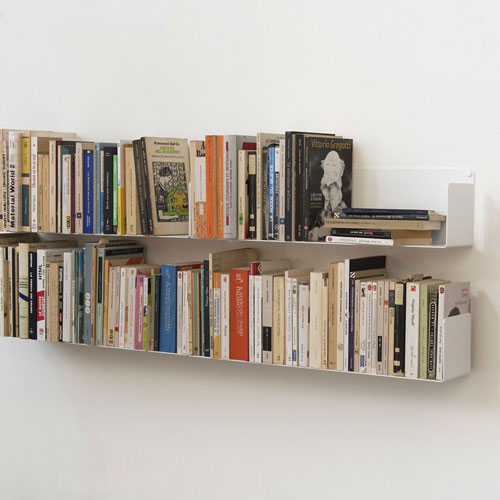
Find the location of a particular element. The height and width of the screenshot is (500, 500). bookend side of shelf is located at coordinates (445, 341), (450, 226), (190, 236), (188, 233), (188, 355), (185, 351).